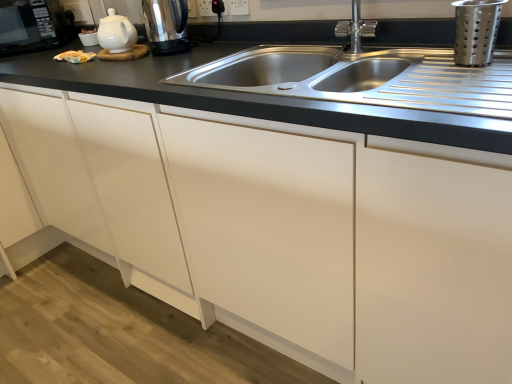
Question: From a real-world perspective, is black plastic outlet at upper center, marked as the first electric outlet in a left-to-right arrangement, under silver metallic faucet at upper center?

Choices:
 (A) no
 (B) yes

Answer: (A)

Question: From the image's perspective, is black plastic outlet at upper center, marked as the first electric outlet in a left-to-right arrangement, on silver metallic faucet at upper center?

Choices:
 (A) yes
 (B) no

Answer: (A)

Question: Does black plastic outlet at upper center, which appears as the second electric outlet when viewed from the right, have a smaller size compared to silver metallic faucet at upper center?

Choices:
 (A) yes
 (B) no

Answer: (A)

Question: Is silver metallic faucet at upper center at the back of black plastic outlet at upper center, marked as the first electric outlet in a left-to-right arrangement?

Choices:
 (A) no
 (B) yes

Answer: (A)

Question: Is black plastic outlet at upper center, marked as the first electric outlet in a left-to-right arrangement, wider than silver metallic faucet at upper center?

Choices:
 (A) no
 (B) yes

Answer: (A)

Question: Is point (218, 11) positioned closer to the camera than point (242, 8)?

Choices:
 (A) closer
 (B) farther

Answer: (B)

Question: From the image's perspective, is black plastic outlet at upper center, marked as the first electric outlet in a left-to-right arrangement, positioned above or below white plastic electric outlet at upper center, the 1th electric outlet when ordered from right to left?

Choices:
 (A) above
 (B) below

Answer: (A)

Question: Looking at the image, does black plastic outlet at upper center, marked as the first electric outlet in a left-to-right arrangement, seem bigger or smaller compared to white plastic electric outlet at upper center, the second electric outlet in the left-to-right sequence?

Choices:
 (A) small
 (B) big

Answer: (B)

Question: Considering the positions of black plastic outlet at upper center, which appears as the second electric outlet when viewed from the right, and white plastic electric outlet at upper center, the 1th electric outlet when ordered from right to left, in the image, is black plastic outlet at upper center, which appears as the second electric outlet when viewed from the right, wider or thinner than white plastic electric outlet at upper center, the 1th electric outlet when ordered from right to left,?

Choices:
 (A) wide
 (B) thin

Answer: (B)

Question: Would you say metallic silver strainer at upper right, which is the second appliance in back-to-front order, is inside or outside stainless steel sink at center?

Choices:
 (A) outside
 (B) inside

Answer: (A)

Question: From a real-world perspective, is metallic silver strainer at upper right, the second appliance in the top-to-bottom sequence, physically located above or below stainless steel sink at center?

Choices:
 (A) below
 (B) above

Answer: (B)

Question: Considering the positions of metallic silver strainer at upper right, arranged as the 1th appliance when ordered from the bottom, and stainless steel sink at center in the image, is metallic silver strainer at upper right, arranged as the 1th appliance when ordered from the bottom, wider or thinner than stainless steel sink at center?

Choices:
 (A) wide
 (B) thin

Answer: (B)

Question: Does point (486, 56) appear closer or farther from the camera than point (351, 127)?

Choices:
 (A) closer
 (B) farther

Answer: (B)

Question: Does point (375, 23) appear closer or farther from the camera than point (177, 52)?

Choices:
 (A) closer
 (B) farther

Answer: (A)

Question: Is silver metallic faucet at upper center in front of or behind polished stainless steel kettle at upper left in the image?

Choices:
 (A) behind
 (B) front

Answer: (B)